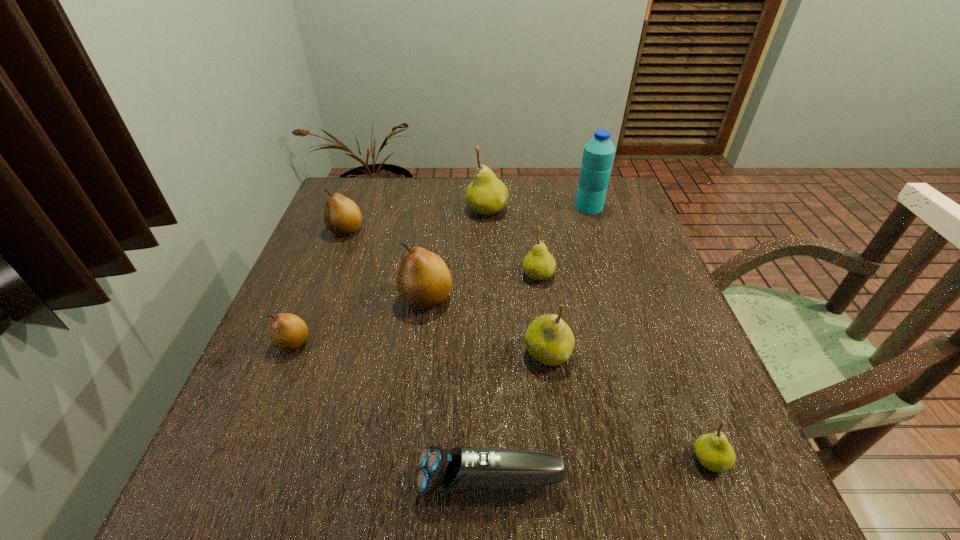
Where is `water bottle`? This screenshot has height=540, width=960. water bottle is located at coordinates (598, 155).

Where is `the biggest green pear`? The width and height of the screenshot is (960, 540). the biggest green pear is located at coordinates (486, 194).

Locate an element on the screen. The width and height of the screenshot is (960, 540). the fourth pear from left to right is located at coordinates (486, 194).

The width and height of the screenshot is (960, 540). In order to click on the third pear from left to right in this screenshot , I will do `click(423, 280)`.

Identify the location of the biggest brown pear. The height and width of the screenshot is (540, 960). (423, 280).

Locate an element on the screen. The width and height of the screenshot is (960, 540). the second nearest green pear is located at coordinates (548, 338).

Locate an element on the screen. This screenshot has width=960, height=540. the farthest brown pear is located at coordinates (342, 216).

Identify the location of the second smallest green pear. The width and height of the screenshot is (960, 540). (539, 264).

The image size is (960, 540). In order to click on the nearest brown pear in this screenshot , I will do `click(287, 332)`.

Find the location of a particular element. The image size is (960, 540). the nearest green pear is located at coordinates (714, 452).